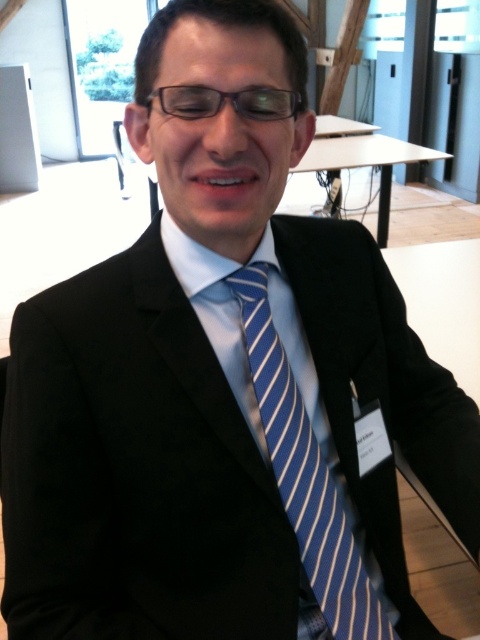
Can you confirm if blue striped tie at center is smaller than white matte table at upper center?

Indeed, blue striped tie at center has a smaller size compared to white matte table at upper center.

Who is more distant from viewer, [384,616] or [362,161]?

Positioned behind is point [362,161].

Locate an element on the screen. This screenshot has width=480, height=640. blue striped tie at center is located at coordinates (305, 476).

Does blue striped tie at center appear on the left side of transparent plastic glasses at center?

Incorrect, blue striped tie at center is not on the left side of transparent plastic glasses at center.

Between blue striped tie at center and transparent plastic glasses at center, which one is positioned lower?

blue striped tie at center

Image resolution: width=480 pixels, height=640 pixels. What are the coordinates of `blue striped tie at center` in the screenshot? It's located at (305, 476).

Consider the image. Is white matte table at upper center to the left of transparent plastic glasses at center from the viewer's perspective?

Incorrect, white matte table at upper center is not on the left side of transparent plastic glasses at center.

Does white matte table at upper center have a lesser width compared to transparent plastic glasses at center?

Incorrect, white matte table at upper center's width is not less than transparent plastic glasses at center's.

Is point (382, 148) more distant than point (223, 99)?

Yes, it is.

Find the location of a particular element. white matte table at upper center is located at coordinates (365, 164).